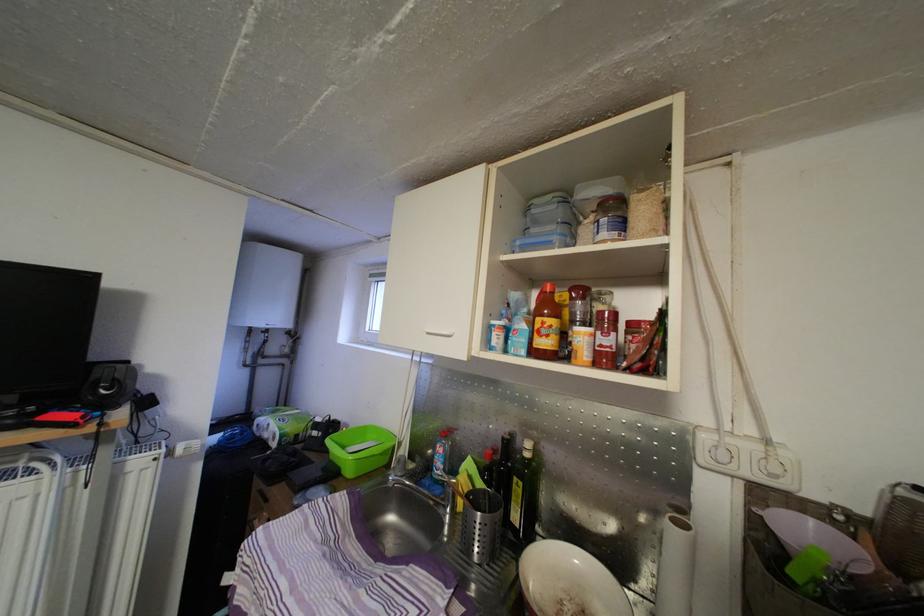
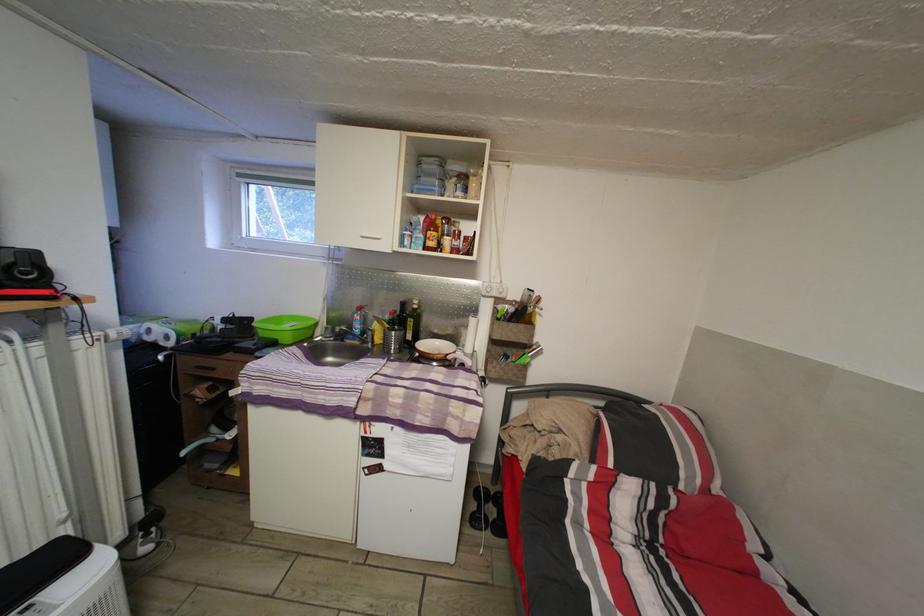
In the second image, find the point that corresponds to [281,419] in the first image.

(144, 328)